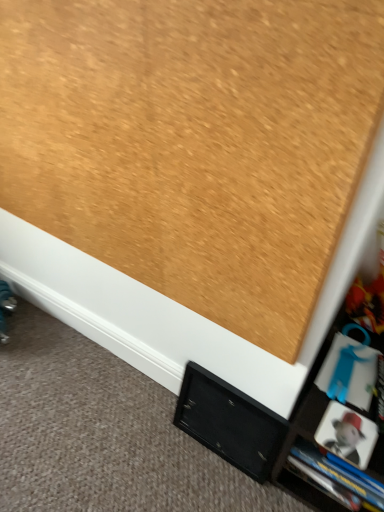
Question: Can you confirm if blue plastic book at lower right is bigger than matte black cabinet at lower right?

Choices:
 (A) yes
 (B) no

Answer: (B)

Question: From the image's perspective, is blue plastic book at lower right located beneath matte black cabinet at lower right?

Choices:
 (A) yes
 (B) no

Answer: (B)

Question: Are blue plastic book at lower right and matte black cabinet at lower right making contact?

Choices:
 (A) yes
 (B) no

Answer: (B)

Question: Can you confirm if blue plastic book at lower right is smaller than matte black cabinet at lower right?

Choices:
 (A) no
 (B) yes

Answer: (B)

Question: From the image's perspective, is blue plastic book at lower right on top of matte black cabinet at lower right?

Choices:
 (A) yes
 (B) no

Answer: (A)

Question: From a real-world perspective, is blue plastic book at lower right physically located above or below black matte cabinet at lower center?

Choices:
 (A) below
 (B) above

Answer: (B)

Question: Considering their positions, is blue plastic book at lower right located in front of or behind black matte cabinet at lower center?

Choices:
 (A) behind
 (B) front

Answer: (B)

Question: Does point (339, 395) appear closer or farther from the camera than point (208, 422)?

Choices:
 (A) closer
 (B) farther

Answer: (A)

Question: In terms of height, does blue plastic book at lower right look taller or shorter compared to black matte cabinet at lower center?

Choices:
 (A) short
 (B) tall

Answer: (A)

Question: Considering the positions of black matte cabinet at lower center and blue plastic book at lower right in the image, is black matte cabinet at lower center bigger or smaller than blue plastic book at lower right?

Choices:
 (A) big
 (B) small

Answer: (A)

Question: Is black matte cabinet at lower center inside or outside of blue plastic book at lower right?

Choices:
 (A) outside
 (B) inside

Answer: (A)

Question: From the image's perspective, is black matte cabinet at lower center above or below blue plastic book at lower right?

Choices:
 (A) above
 (B) below

Answer: (B)

Question: Considering the positions of point (263, 471) and point (337, 371), is point (263, 471) closer or farther from the camera than point (337, 371)?

Choices:
 (A) farther
 (B) closer

Answer: (A)

Question: From a real-world perspective, is matte black cabinet at lower right physically located above or below black matte cabinet at lower center?

Choices:
 (A) above
 (B) below

Answer: (A)

Question: Would you say matte black cabinet at lower right is to the left or to the right of black matte cabinet at lower center in the picture?

Choices:
 (A) right
 (B) left

Answer: (A)